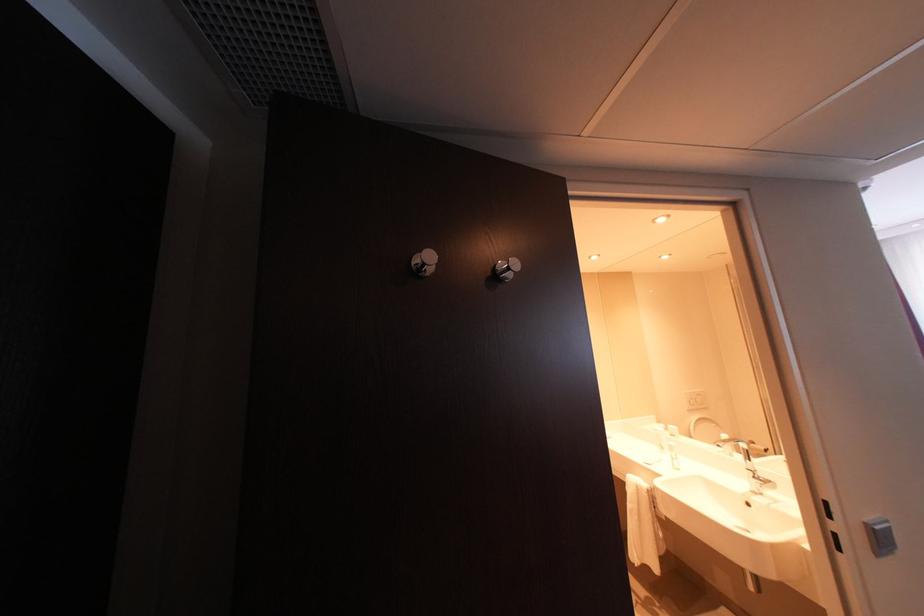
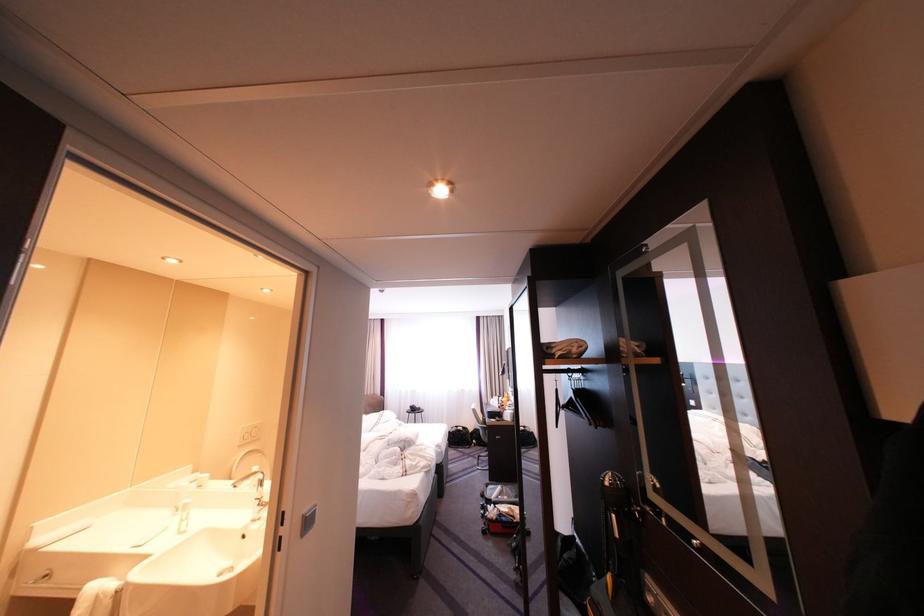
The point at (878, 525) is marked in the first image. Where is the corresponding point in the second image?

(314, 516)